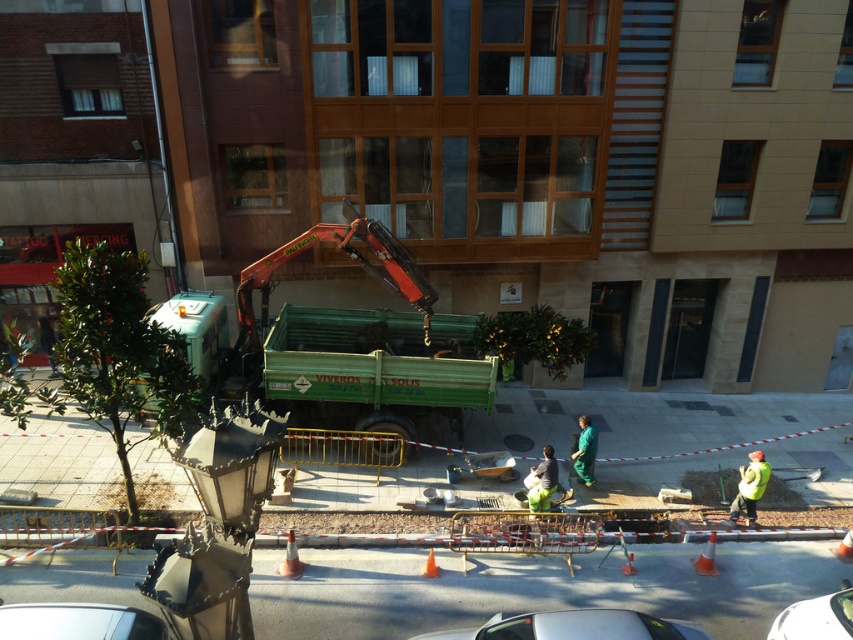
Is high visibility yellow jacket at lower right positioned in front of orange reflective cone at center?

No.

Between point (759, 468) and point (293, 557), which one is positioned behind?

Point (759, 468)

Where is `high visibility yellow jacket at lower right`? The width and height of the screenshot is (853, 640). high visibility yellow jacket at lower right is located at coordinates (749, 486).

Is silver metallic car at lower center taller than orange plastic cone at center?

Yes.

Is silver metallic car at lower center shorter than orange plastic cone at center?

Incorrect, silver metallic car at lower center's height does not fall short of orange plastic cone at center's.

This screenshot has width=853, height=640. In order to click on silver metallic car at lower center in this screenshot , I will do `click(576, 627)`.

Is white glossy car at lower right bigger than orange traffic cone at lower center?

Correct, white glossy car at lower right is larger in size than orange traffic cone at lower center.

Can you confirm if white glossy car at lower right is positioned above orange traffic cone at lower center?

No.

Does point (793, 605) lie in front of point (694, 564)?

Yes, it is.

Image resolution: width=853 pixels, height=640 pixels. Identify the location of white glossy car at lower right. (815, 618).